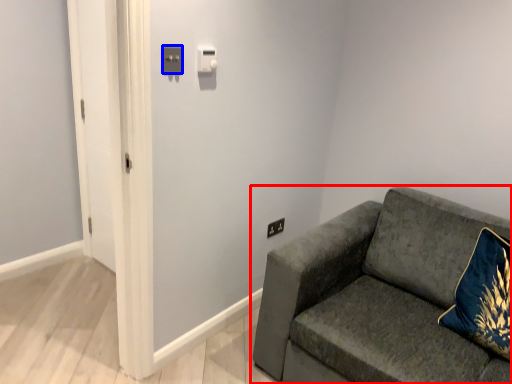
Question: Which of the following is the closest to the observer, studio couch (highlighted by a red box) or light switch (highlighted by a blue box)?

Choices:
 (A) studio couch
 (B) light switch

Answer: (A)